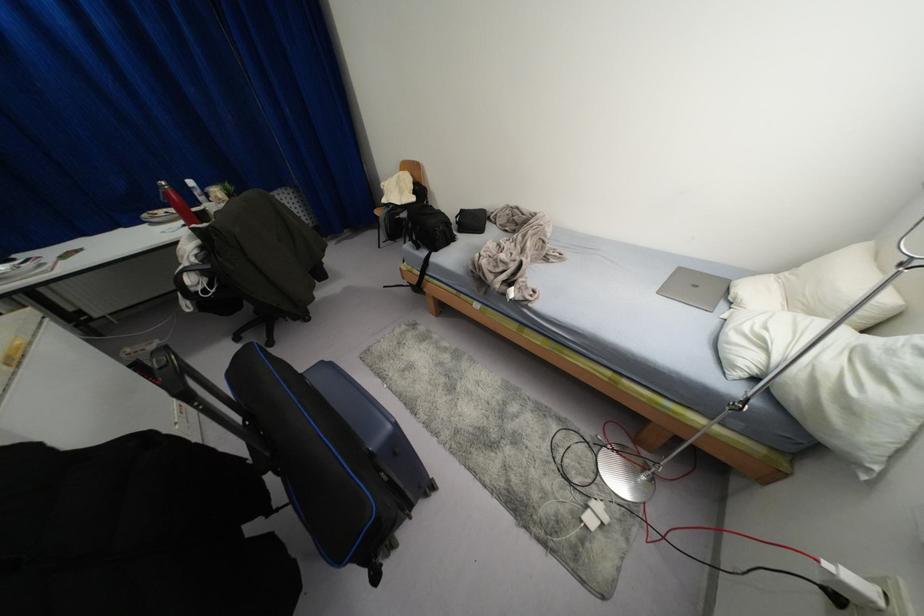
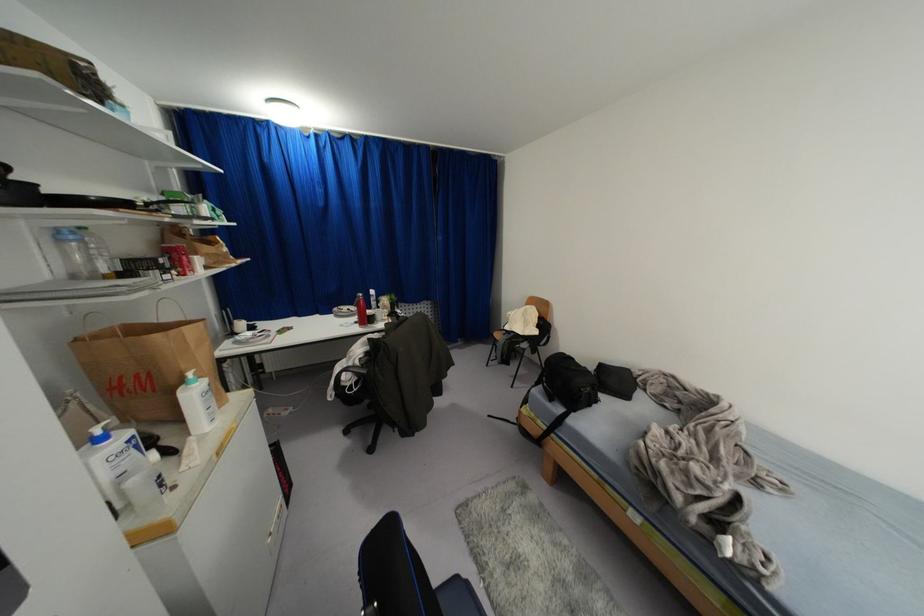
Where in the second image is the point corresponding to the point at 165,193 from the first image?

(359, 301)